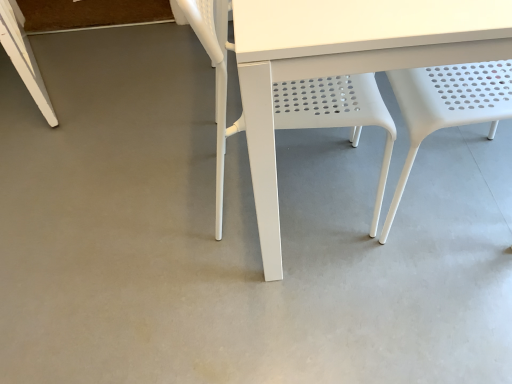
Locate an element on the screen. free point below white plastic chair at center, which appears as the 2th chair when viewed from the right (from a real-world perspective) is located at coordinates (300, 193).